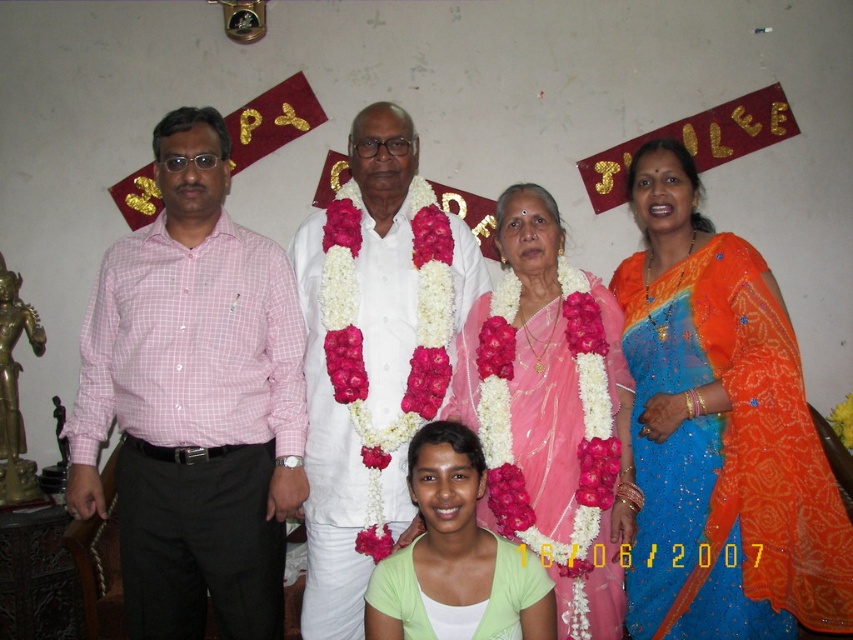
Does pink silk saree at center appear on the right side of white clothed man at center?

Correct, you'll find pink silk saree at center to the right of white clothed man at center.

Based on the photo, can you confirm if pink silk saree at center is positioned below white clothed man at center?

Yes.

Does point (590, 552) lie in front of point (370, 148)?

Yes, it is in front of point (370, 148).

Identify the location of pink silk saree at center. The image size is (853, 640). (552, 412).

Does white clothed man at center appear under light green fabric at center?

Actually, white clothed man at center is above light green fabric at center.

Image resolution: width=853 pixels, height=640 pixels. Identify the location of white clothed man at center. (328, 470).

Can you confirm if pink checkered shirt at left is positioned below pink silk saree at center?

Actually, pink checkered shirt at left is above pink silk saree at center.

Is pink checkered shirt at left shorter than pink silk saree at center?

In fact, pink checkered shirt at left may be taller than pink silk saree at center.

Is point (79, 429) less distant than point (527, 323)?

Yes, it is in front of point (527, 323).

At what (x,y) coordinates should I click in order to perform the action: click on pink checkered shirt at left. Please return your answer as a coordinate pair (x, y). Image resolution: width=853 pixels, height=640 pixels. Looking at the image, I should click on (194, 401).